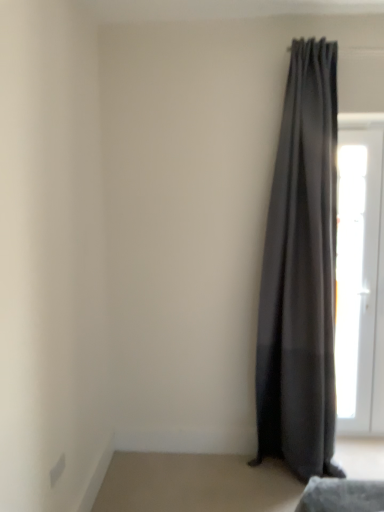
Find the location of `white glossy door at right`. white glossy door at right is located at coordinates (360, 280).

Image resolution: width=384 pixels, height=512 pixels. Describe the element at coordinates (360, 280) in the screenshot. I see `white glossy door at right` at that location.

This screenshot has width=384, height=512. In order to click on dark gray sheer curtain at right in this screenshot , I will do `click(301, 273)`.

The image size is (384, 512). Describe the element at coordinates (301, 273) in the screenshot. I see `dark gray sheer curtain at right` at that location.

In order to face dark gray sheer curtain at right, should I rotate leftwards or rightwards?

You should rotate right by 15.158 degrees.

Locate an element on the screen. The width and height of the screenshot is (384, 512). white glossy door at right is located at coordinates (360, 280).

Which is more to the right, white glossy door at right or dark gray sheer curtain at right?

white glossy door at right is more to the right.

Which is in front, white glossy door at right or dark gray sheer curtain at right?

dark gray sheer curtain at right is more forward.

Which is less distant, (348, 244) or (296, 435)?

Clearly, point (348, 244) is more distant from the camera than point (296, 435).

From the image's perspective, which one is positioned higher, white glossy door at right or dark gray sheer curtain at right?

dark gray sheer curtain at right.

From a real-world perspective, between white glossy door at right and dark gray sheer curtain at right, who is vertically lower?

In real-world perspective, white glossy door at right is lower.

Consider the image. Is white glossy door at right wider than dark gray sheer curtain at right?

Incorrect, the width of white glossy door at right does not surpass that of dark gray sheer curtain at right.

Between white glossy door at right and dark gray sheer curtain at right, which one has less height?

white glossy door at right.

Between white glossy door at right and dark gray sheer curtain at right, which one has larger size?

Bigger between the two is dark gray sheer curtain at right.

Would you say white glossy door at right is outside dark gray sheer curtain at right?

Yes.

Is white glossy door at right positioned far away from dark gray sheer curtain at right?

No.

Is dark gray sheer curtain at right at the back of white glossy door at right?

No, white glossy door at right is not facing the opposite direction of dark gray sheer curtain at right.

Find the location of a particular element. The image size is (384, 512). door located below the dark gray sheer curtain at right (from the image's perspective) is located at coordinates (360, 280).

Is dark gray sheer curtain at right at the right side of white glossy door at right?

No.

Which is behind, dark gray sheer curtain at right or white glossy door at right?

Positioned behind is white glossy door at right.

Is point (308, 341) closer or farther from the camera than point (368, 221)?

Point (308, 341) is positioned closer to the camera compared to point (368, 221).

From the image's perspective, relative to white glossy door at right, is dark gray sheer curtain at right above or below?

Based on their image positions, dark gray sheer curtain at right is located above white glossy door at right.

From a real-world perspective, is dark gray sheer curtain at right above or below white glossy door at right?

From a real-world perspective, dark gray sheer curtain at right is physically above white glossy door at right.

Does dark gray sheer curtain at right have a lesser width compared to white glossy door at right?

In fact, dark gray sheer curtain at right might be wider than white glossy door at right.

Which of these two, dark gray sheer curtain at right or white glossy door at right, stands taller?

With more height is dark gray sheer curtain at right.

Is dark gray sheer curtain at right smaller than white glossy door at right?

Actually, dark gray sheer curtain at right might be larger than white glossy door at right.

Would you say dark gray sheer curtain at right contains white glossy door at right?

No, white glossy door at right is not surrounded by dark gray sheer curtain at right.

Are dark gray sheer curtain at right and white glossy door at right beside each other?

No, dark gray sheer curtain at right is not beside white glossy door at right.

Is dark gray sheer curtain at right turned away from white glossy door at right?

No, white glossy door at right is not at the back of dark gray sheer curtain at right.

How far apart are dark gray sheer curtain at right and white glossy door at right?

dark gray sheer curtain at right is 53.26 centimeters away from white glossy door at right.

What are the coordinates of `curtain that appears in front of the white glossy door at right` in the screenshot? It's located at (301, 273).

Where is `curtain that is above the white glossy door at right (from the image's perspective)`? The image size is (384, 512). curtain that is above the white glossy door at right (from the image's perspective) is located at coordinates (301, 273).

Locate an element on the screen. The image size is (384, 512). door below the dark gray sheer curtain at right (from the image's perspective) is located at coordinates (360, 280).